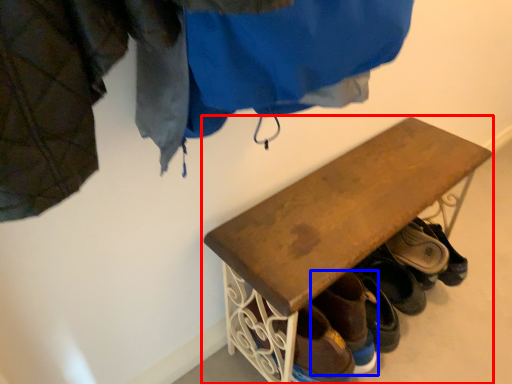
Question: Among these objects, which one is nearest to the camera, furniture (highlighted by a red box) or footwear (highlighted by a blue box)?

Choices:
 (A) furniture
 (B) footwear

Answer: (A)